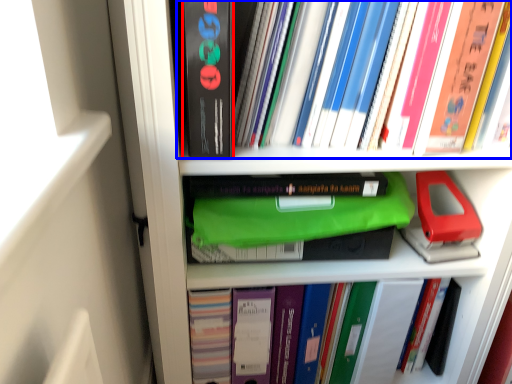
Question: Which point is closer to the camera, paperback book (highlighted by a red box) or book (highlighted by a blue box)?

Choices:
 (A) paperback book
 (B) book

Answer: (A)